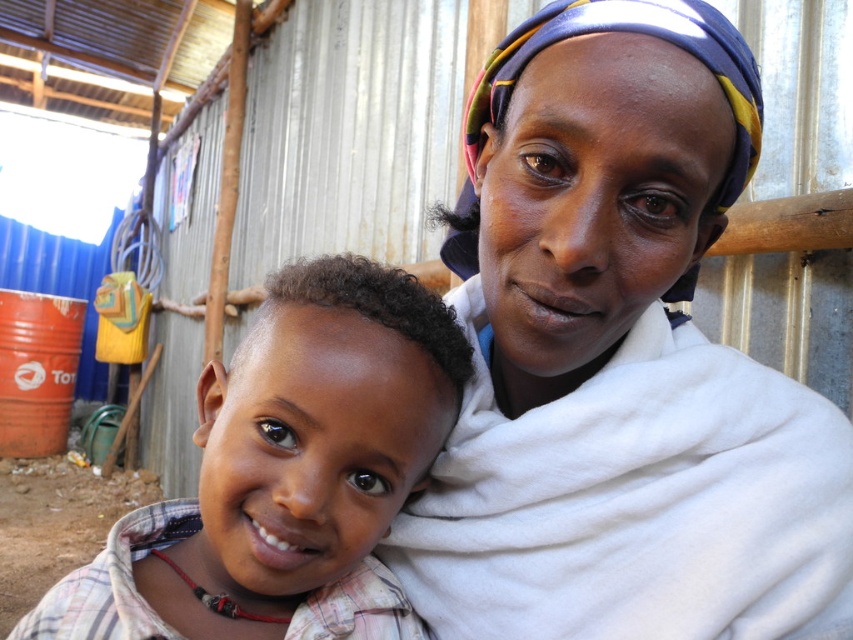
You are a photographer setting up for a family photo. You have a white cloth at center and a light brown plaid shirt at center in your frame. Which item has a greater width in the image?

The white cloth at center has a greater width than the light brown plaid shirt at center according to the description.

You are a photographer standing 20 inches away from the camera. You want to take a photo of the white cloth at center. Can you reach it without moving closer than your current position?

The white cloth at center is 16.60 inches away from the camera. Since you are 20 inches away from the camera, you are farther away than the cloth. To reach it, you would need to move closer to within 16.60 inches.